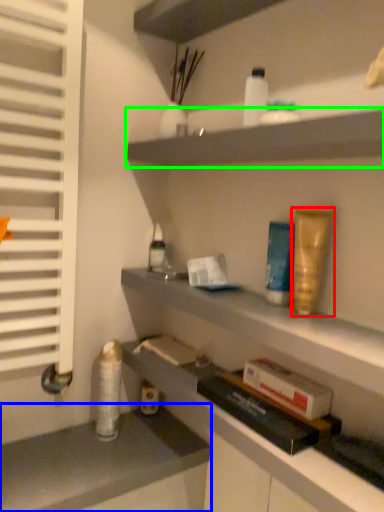
Question: Which is nearer to the toiletry (highlighted by a red box)? counter (highlighted by a blue box) or shelf (highlighted by a green box).

Choices:
 (A) counter
 (B) shelf

Answer: (B)